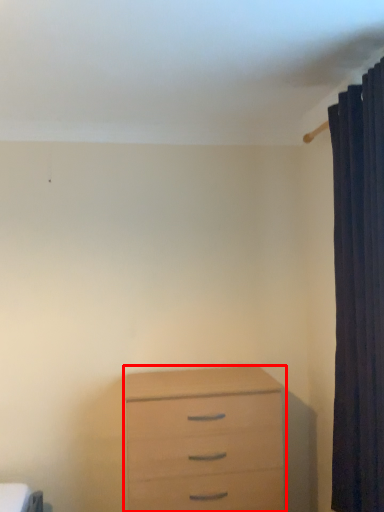
Question: From the image's perspective, where is chest of drawers (annotated by the red box) located relative to curtain?

Choices:
 (A) above
 (B) below

Answer: (B)